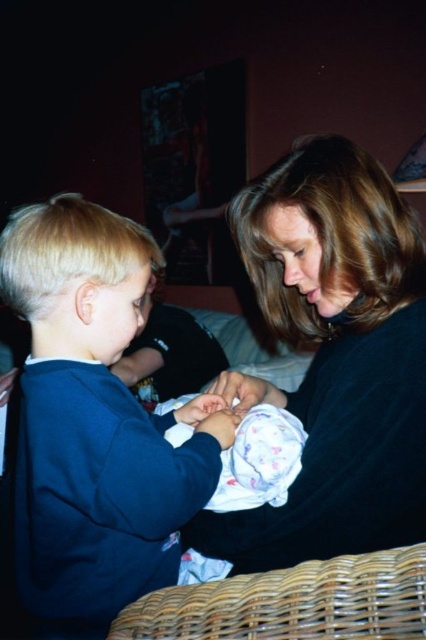
Question: Is black matte sweater at center closer to the viewer compared to dark blue sweatshirt at left?

Choices:
 (A) no
 (B) yes

Answer: (A)

Question: Can you confirm if dark blue sweatshirt at left is positioned to the right of woven brown basket at lower center?

Choices:
 (A) no
 (B) yes

Answer: (A)

Question: Which object appears farthest from the camera in this image?

Choices:
 (A) black matte sweater at center
 (B) woven brown basket at lower center
 (C) fluffy white blanket at center
 (D) dark blue sweatshirt at left

Answer: (C)

Question: Which is farther from the black matte sweater at center?

Choices:
 (A) fluffy white blanket at center
 (B) woven brown basket at lower center

Answer: (B)

Question: Which of the following is the closest to the observer?

Choices:
 (A) black matte sweater at center
 (B) woven brown basket at lower center

Answer: (B)

Question: Is dark blue sweatshirt at left positioned at the back of woven brown basket at lower center?

Choices:
 (A) yes
 (B) no

Answer: (A)